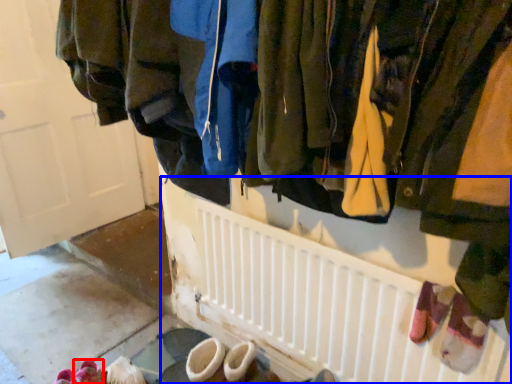
Question: Which object is closer to the camera taking this photo, footwear (highlighted by a red box) or radiator (highlighted by a blue box)?

Choices:
 (A) footwear
 (B) radiator

Answer: (B)